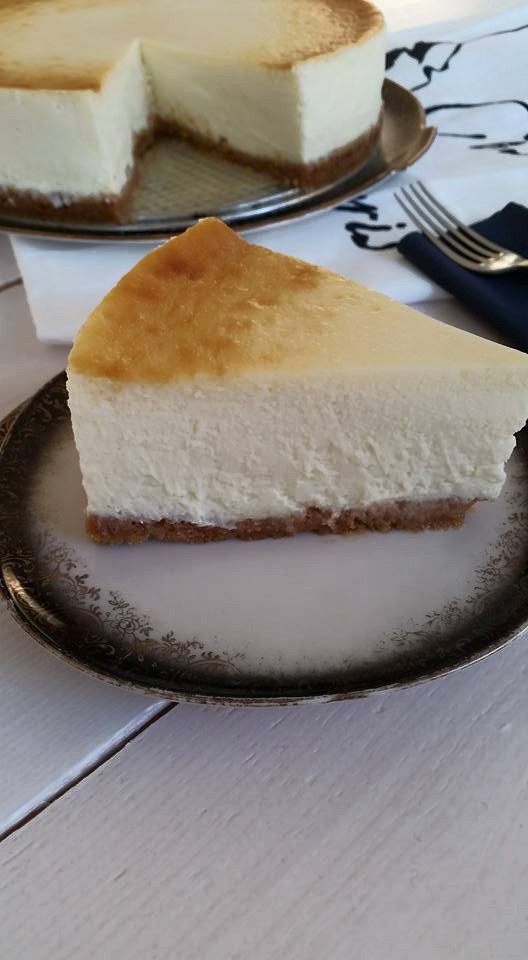
Locate an element on the screen. This screenshot has width=528, height=960. placemat is located at coordinates (x=332, y=224).